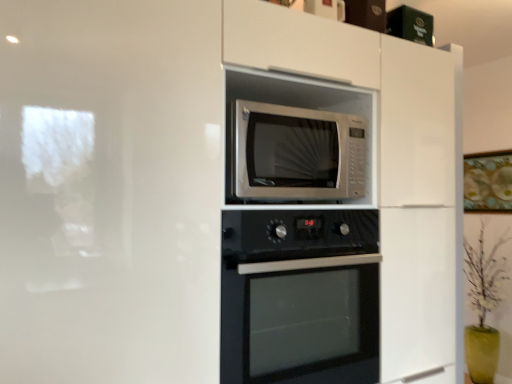
Question: From the image's perspective, is white glossy microwave at upper center above or below silver metallic microwave at center?

Choices:
 (A) below
 (B) above

Answer: (A)

Question: In the image, is white glossy microwave at upper center positioned in front of or behind silver metallic microwave at center?

Choices:
 (A) front
 (B) behind

Answer: (A)

Question: Which is farther from the silver metallic microwave at center?

Choices:
 (A) white glossy microwave at upper center
 (B) black glass oven at center

Answer: (B)

Question: Estimate the real-world distances between objects in this image. Which object is farther from the silver metallic microwave at center?

Choices:
 (A) white glossy microwave at upper center
 (B) black glass oven at center

Answer: (B)